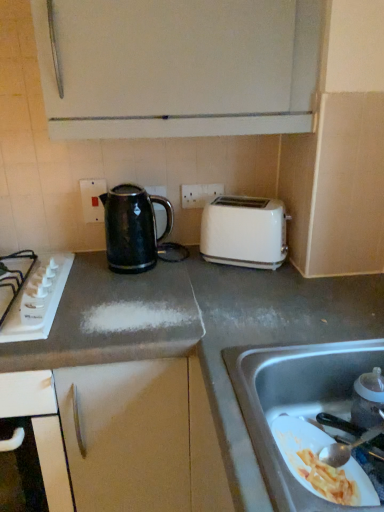
The width and height of the screenshot is (384, 512). Find the location of `vacant region to the left of white glossy toaster at upper right`. vacant region to the left of white glossy toaster at upper right is located at coordinates tap(192, 268).